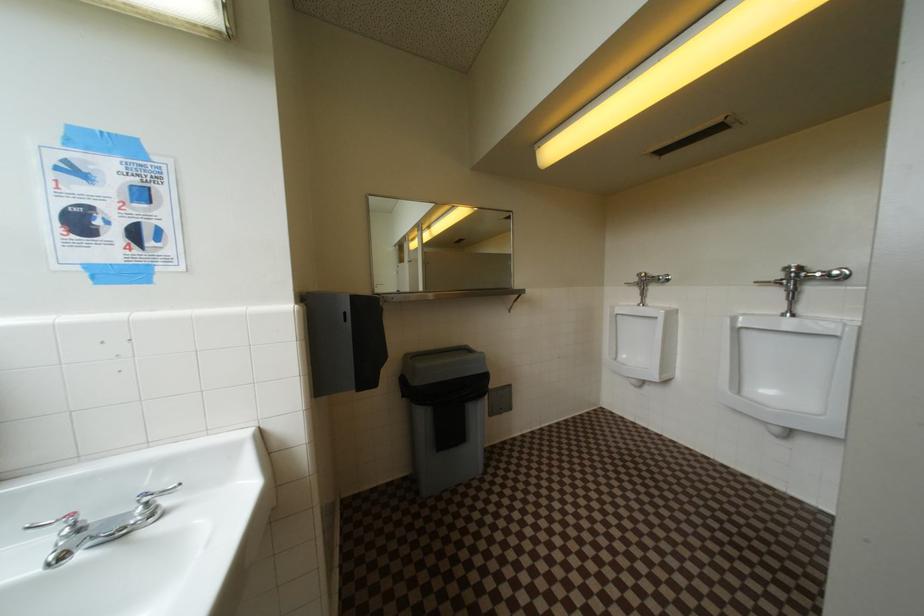
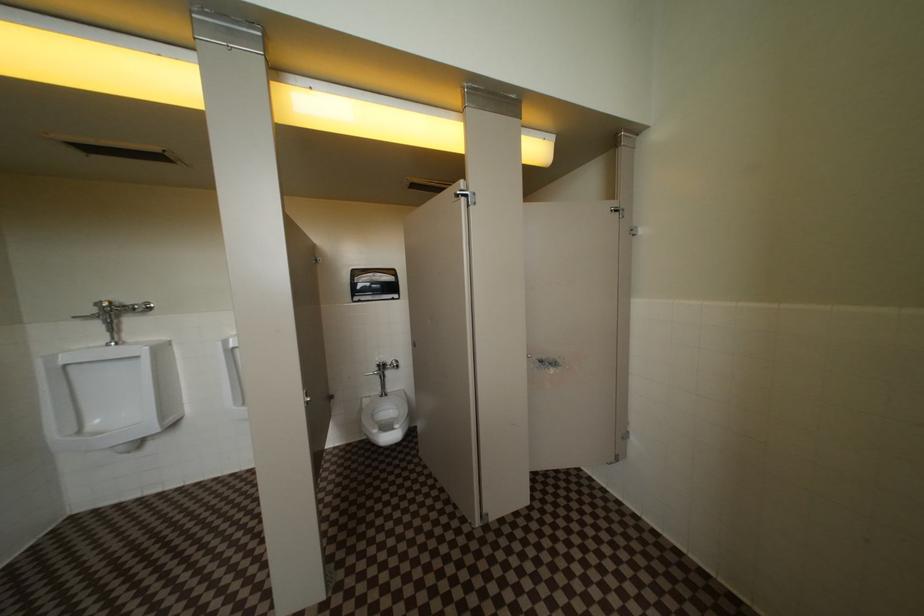
Question: How did the camera likely rotate?

Choices:
 (A) Left
 (B) Right
 (C) Up
 (D) Down

Answer: (B)